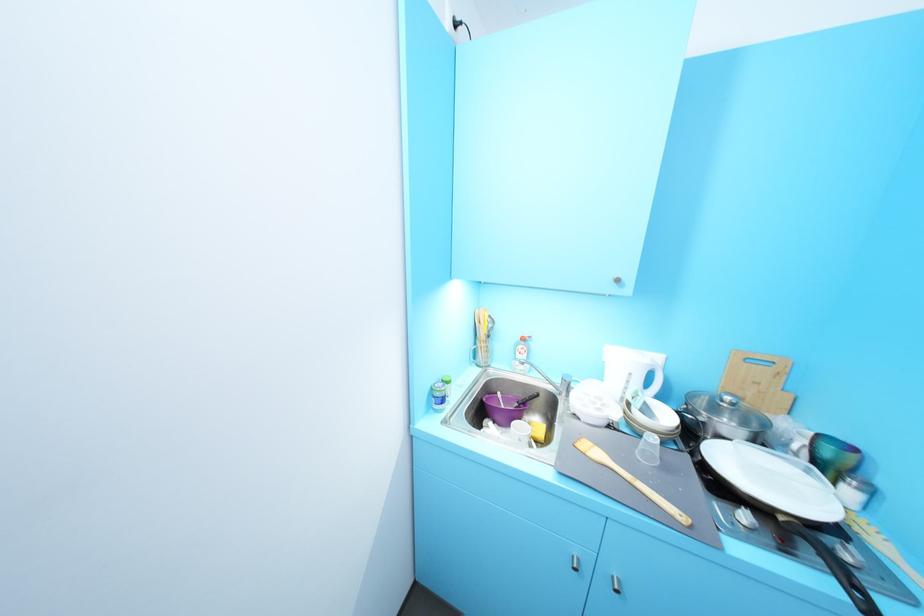
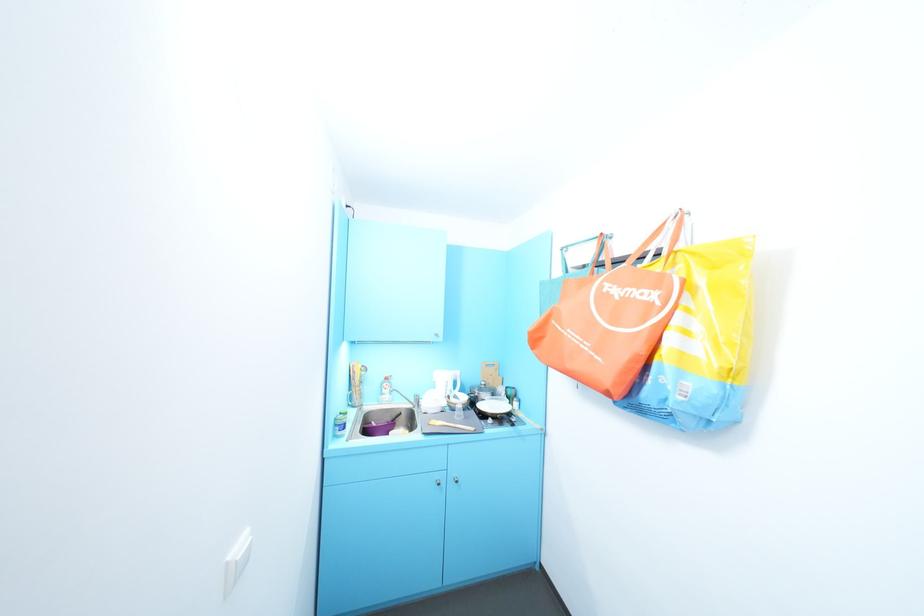
Find the pixel in the second image that matches point (673, 468) in the first image.

(472, 418)